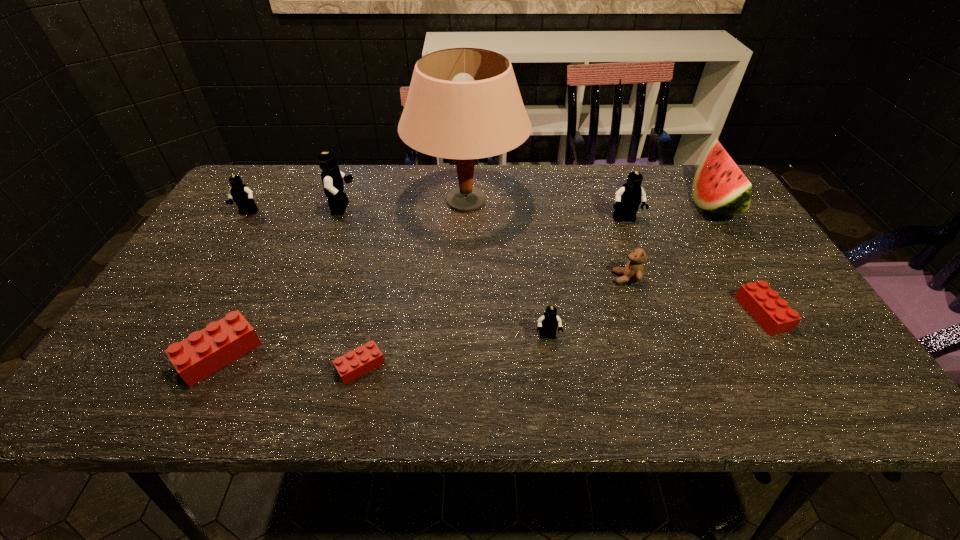
Locate an element on the screen. This screenshot has width=960, height=540. free space that is in between the third Lego from left to right and the fifth tallest Lego is located at coordinates (281, 281).

At what (x,y) coordinates should I click in order to perform the action: click on free spot between the third shortest object and the tallest object. Please return your answer as a coordinate pair (x, y). The height and width of the screenshot is (540, 960). Looking at the image, I should click on (344, 278).

Identify the location of vacant area that lies between the rightmost black Lego and the second smallest black Lego. The height and width of the screenshot is (540, 960). (436, 217).

Find the location of `blank region between the tallest Lego and the nearest black Lego`. blank region between the tallest Lego and the nearest black Lego is located at coordinates (445, 273).

Where is `vacant point located between the second black Lego from left to right and the second shortest object`? The height and width of the screenshot is (540, 960). vacant point located between the second black Lego from left to right and the second shortest object is located at coordinates (553, 261).

The image size is (960, 540). In order to click on object that is the eighth closest to the leftmost black Lego in this screenshot , I will do `click(719, 186)`.

Identify which object is located as the seventh nearest to the sixth shortest Lego. Please provide its 2D coordinates. Your answer should be formatted as a tuple, i.e. [(x, y)], where the tuple contains the x and y coordinates of a point satisfying the conditions above.

[(332, 178)]

Identify which Lego is the fifth nearest to the biggest black Lego. Please provide its 2D coordinates. Your answer should be formatted as a tuple, i.e. [(x, y)], where the tuple contains the x and y coordinates of a point satisfying the conditions above.

[(628, 198)]

Identify which Lego is located as the nearest to the third Lego from left to right. Please provide its 2D coordinates. Your answer should be formatted as a tuple, i.e. [(x, y)], where the tuple contains the x and y coordinates of a point satisfying the conditions above.

[(240, 193)]

Locate an element on the screen. The image size is (960, 540). the second closest black Lego to the leftmost object is located at coordinates (548, 323).